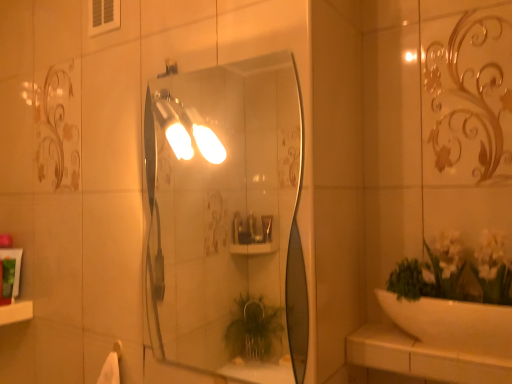
Question: Considering the positions of point (14, 301) and point (424, 370), is point (14, 301) closer or farther from the camera than point (424, 370)?

Choices:
 (A) closer
 (B) farther

Answer: (B)

Question: Would you say white glossy ledge at lower left is inside or outside white ceramic counter top at lower right?

Choices:
 (A) outside
 (B) inside

Answer: (A)

Question: Which object is the farthest from the green matte tube at left, marked as the first toiletry in a back-to-front arrangement?

Choices:
 (A) green matte tube at left, the 1th toiletry in the front-to-back sequence
 (B) white ceramic counter top at lower right
 (C) matte glass mirror at center
 (D) white glossy ledge at lower left
 (E) matte silver light fixture at upper center

Answer: (C)

Question: Considering the real-world distances, which object is closest to the matte silver light fixture at upper center?

Choices:
 (A) matte glass mirror at center
 (B) white glossy ledge at lower left
 (C) green matte tube at left, the second toiletry positioned from the back
 (D) green matte tube at left, acting as the second toiletry starting from the front
 (E) white ceramic counter top at lower right

Answer: (E)